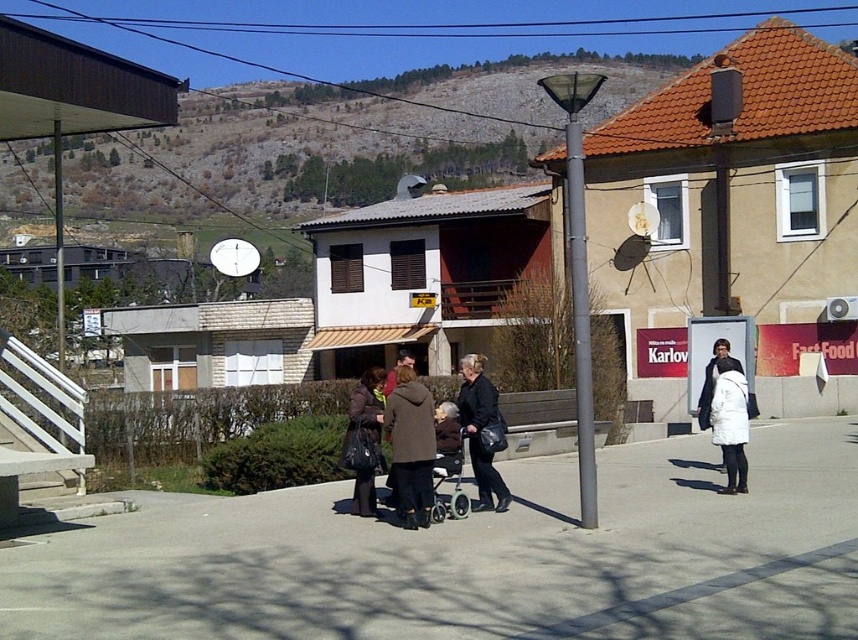
The width and height of the screenshot is (858, 640). Describe the element at coordinates (449, 426) in the screenshot. I see `brown leather coat at center` at that location.

Does brown leather coat at center appear under metallic gray baby carriage at center?

No, brown leather coat at center is not below metallic gray baby carriage at center.

Is point (405, 372) closer to viewer compared to point (444, 515)?

That is True.

The image size is (858, 640). In order to click on brown leather coat at center in this screenshot , I will do `click(449, 426)`.

Does point (718, 365) come farther from viewer compared to point (367, 371)?

That is False.

From the picture: Does white matte coat at lower right have a greater width compared to matte brown coat at center?

Yes.

Between point (747, 420) and point (369, 499), which one is positioned in front?

Positioned in front is point (369, 499).

Locate an element on the screen. The height and width of the screenshot is (640, 858). white matte coat at lower right is located at coordinates (730, 422).

Can you confirm if brown wool coat at center is taller than matte brown coat at center?

Indeed, brown wool coat at center has a greater height compared to matte brown coat at center.

Is brown wool coat at center closer to camera compared to matte brown coat at center?

Yes, brown wool coat at center is in front of matte brown coat at center.

Locate an element on the screen. This screenshot has height=640, width=858. brown wool coat at center is located at coordinates point(411,448).